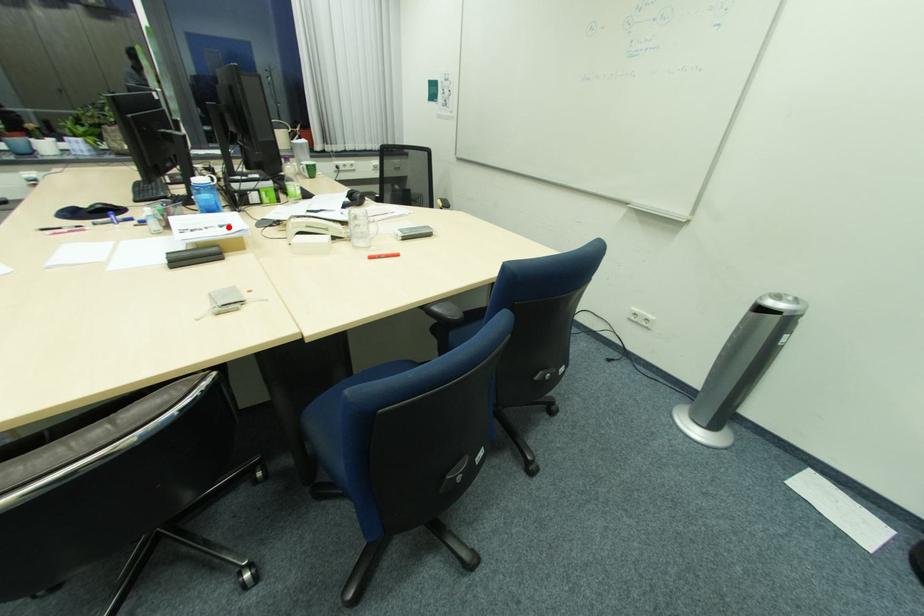
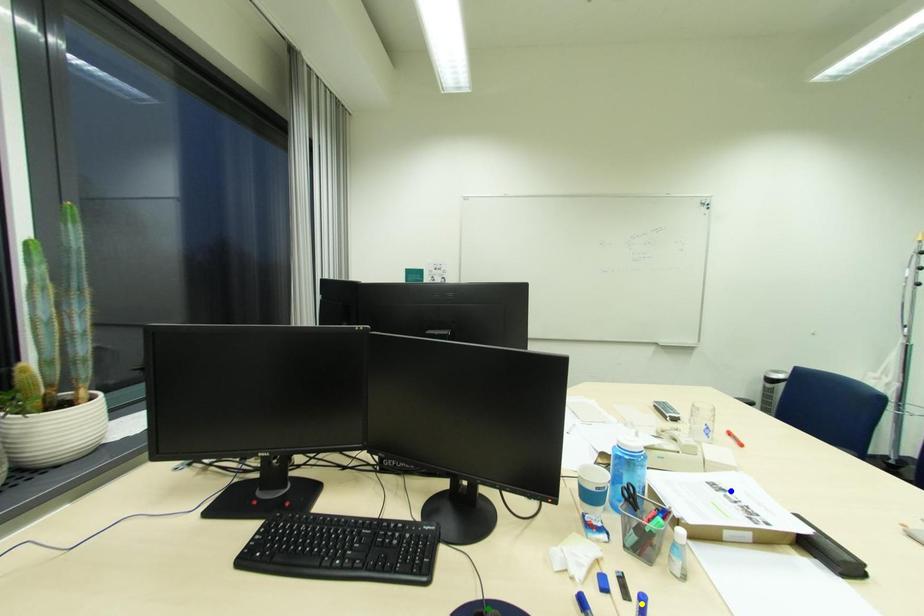
Question: I am providing you with two images of the same scene from different viewpoints. A red point is marked on the first image. You are given multiple points on the second image. Which point in image 2 is actually the same real-world point as the red point in image 1?

Choices:
 (A) yellow point
 (B) green point
 (C) blue point

Answer: (C)